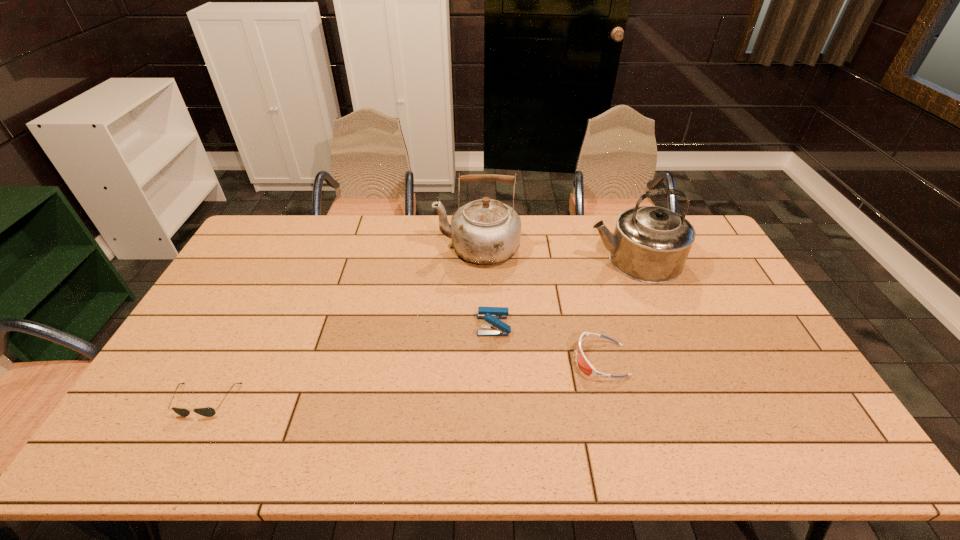
Locate an element on the screen. This screenshot has width=960, height=540. object that is at the far right corner is located at coordinates (650, 244).

Locate an element on the screen. The image size is (960, 540). vacant space at the far edge of the desktop is located at coordinates (577, 215).

At what (x,y) coordinates should I click in order to perform the action: click on vacant space at the near edge of the desktop. Please return your answer as a coordinate pair (x, y). Image resolution: width=960 pixels, height=540 pixels. Looking at the image, I should click on (218, 431).

The image size is (960, 540). In order to click on free location at the left edge in this screenshot , I will do `click(229, 302)`.

The height and width of the screenshot is (540, 960). Identify the location of vacant space at the right edge. (705, 296).

This screenshot has width=960, height=540. In the image, there is a desktop. In order to click on vacant space at the near left corner in this screenshot , I will do `click(143, 456)`.

Where is `vacant area at the near right corner of the desktop`? Image resolution: width=960 pixels, height=540 pixels. vacant area at the near right corner of the desktop is located at coordinates (819, 438).

The image size is (960, 540). Identify the location of free spot between the left kettle and the goggles. (539, 304).

Identify the location of free space between the stapler and the goggles. This screenshot has width=960, height=540. (547, 343).

Find the location of a particular element. vacant area between the left kettle and the right kettle is located at coordinates (556, 254).